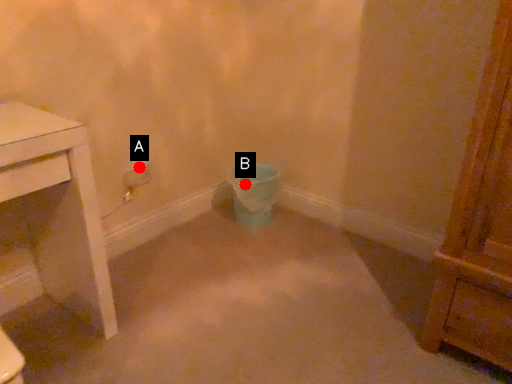
Question: Two points are circled on the image, labeled by A and B beside each circle. Which point is closer to the camera?

Choices:
 (A) A is closer
 (B) B is closer

Answer: (A)